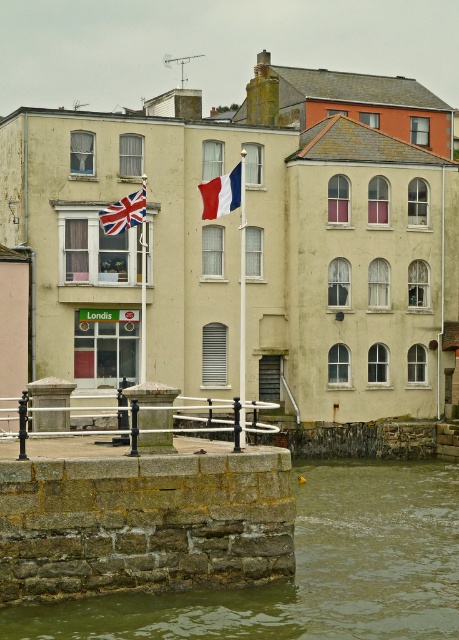
Is smooth metal railing at center closer to the viewer compared to union jack fabric flag at upper left?

Yes, smooth metal railing at center is closer to the viewer.

This screenshot has height=640, width=459. In order to click on smooth metal railing at center in this screenshot , I will do `click(161, 419)`.

Identify the location of smooth metal railing at center. (161, 419).

Who is lower down, brown stone wall at lower left or smooth metal railing at center?

brown stone wall at lower left is lower down.

Does brown stone wall at lower left appear on the left side of smooth metal railing at center?

No, brown stone wall at lower left is not to the left of smooth metal railing at center.

Locate an element on the screen. This screenshot has height=640, width=459. brown stone wall at lower left is located at coordinates (307, 570).

Is smooth metal railing at center bigger than smooth fabric flag at center?

Yes.

Locate an element on the screen. The width and height of the screenshot is (459, 640). smooth metal railing at center is located at coordinates (161, 419).

At what (x,y) coordinates should I click in order to perform the action: click on smooth metal railing at center. Please return your answer as a coordinate pair (x, y). Looking at the image, I should click on (161, 419).